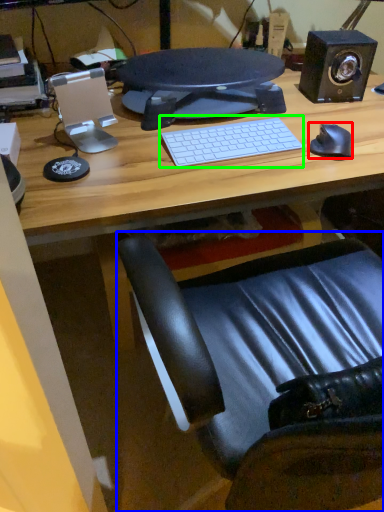
Question: Considering the real-world distances, which object is closest to mouse (highlighted by a red box)? chair (highlighted by a blue box) or computer keyboard (highlighted by a green box).

Choices:
 (A) chair
 (B) computer keyboard

Answer: (B)